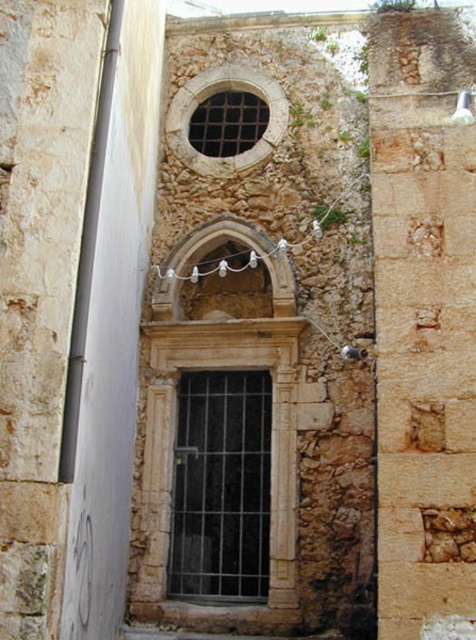
Looking at this image, you are an architect examining the aged stone building. You notice the stone textured window at upper center and the white stone archway at center. Which one has a greater height?

The stone textured window at upper center is taller than the white stone archway at center.

You are an architect examining the aged stone building. You notice the stone textured window at upper center and the white stone archway at center. Which of these two features has a larger size?

The stone textured window at upper center is bigger than the white stone archway at center, so the window is larger in size.

You are an architect examining the aged stone building. You need to install a new security camera that must be placed exactly at point coordinates of 0.759 on the x and 0.464 on the y. Is this point where the black metal window at center is located?

Yes, the black metal window at center is located at point coordinates of 0.759 on the x and 0.464 on the y, so the camera can be placed there.